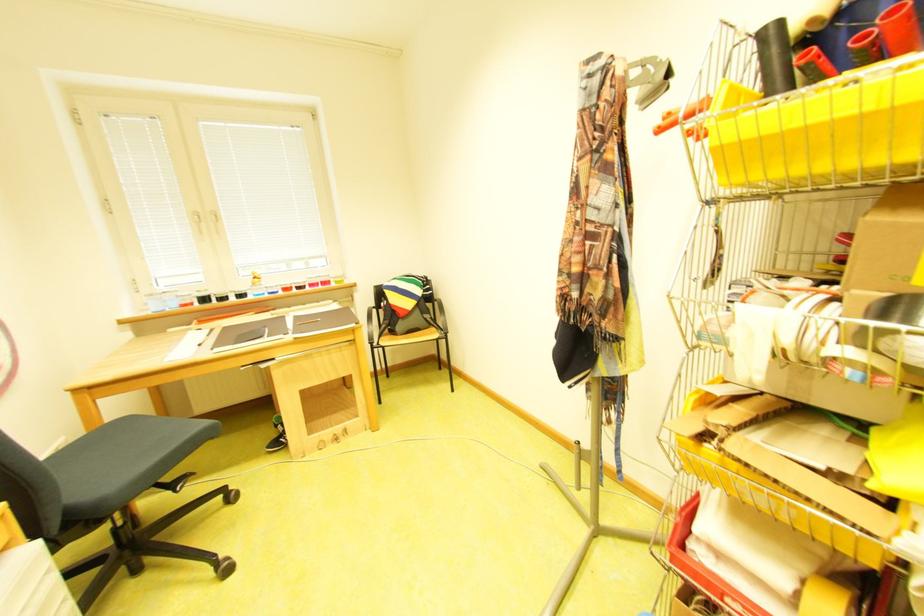
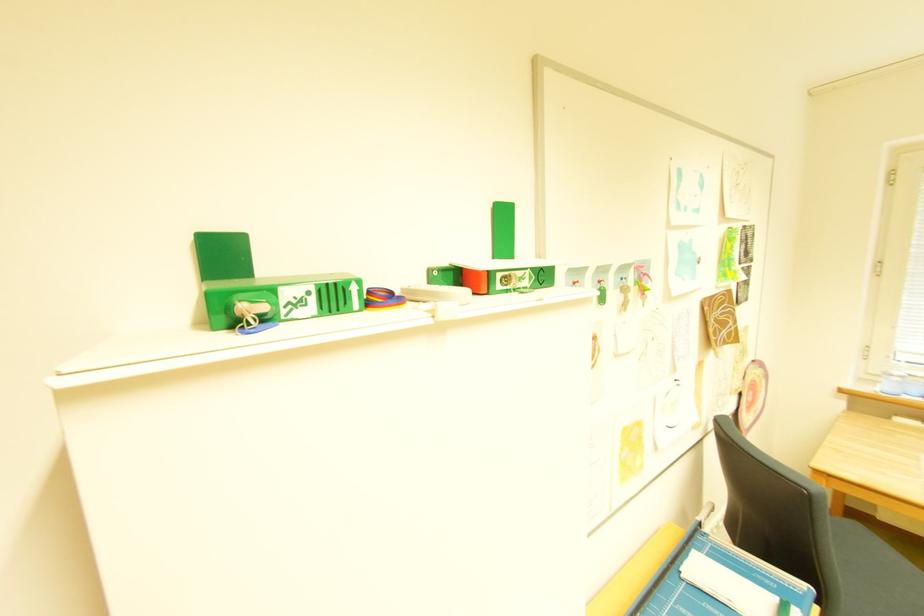
Question: Based on the continuous images, in which direction is the camera rotating? Reply with the corresponding letter.

Choices:
 (A) Left
 (B) Right
 (C) Up
 (D) Down

Answer: (A)